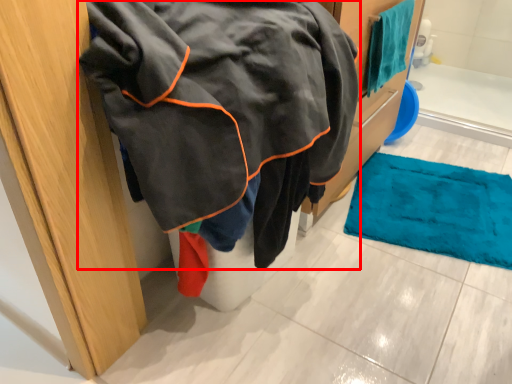
Question: From the image's perspective, where is jacket (annotated by the red box) located in relation to towel in the image?

Choices:
 (A) above
 (B) below

Answer: (B)